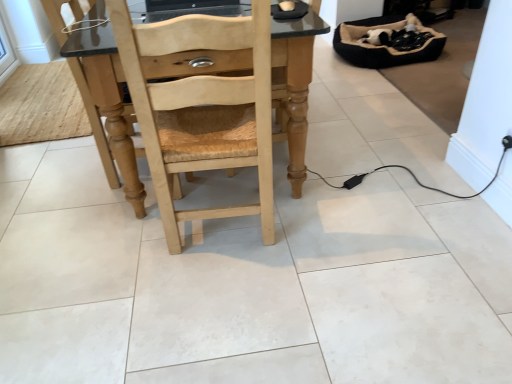
This screenshot has width=512, height=384. I want to click on vacant area that lies to the right of natural wood chair at center, so click(x=327, y=222).